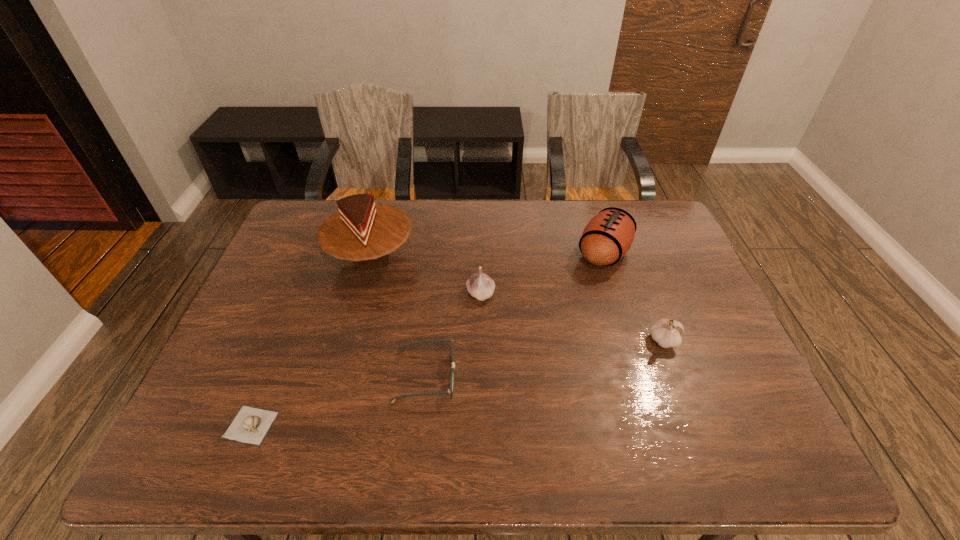
This screenshot has width=960, height=540. Find the location of `the tallest object`. the tallest object is located at coordinates point(362,231).

Locate an element on the screen. This screenshot has height=540, width=960. football (American) is located at coordinates (607, 237).

Where is `the second garlic from left to right`? This screenshot has width=960, height=540. the second garlic from left to right is located at coordinates (480, 286).

In order to click on the fourth object from left to right in this screenshot , I will do `click(480, 286)`.

Identify the location of the second farthest garlic. This screenshot has height=540, width=960. pos(666,332).

Locate an element on the screen. This screenshot has height=540, width=960. spectacles is located at coordinates (450, 391).

What are the coordinates of `the shortest object` in the screenshot? It's located at pyautogui.click(x=250, y=425).

At what (x,y) coordinates should I click in order to perform the action: click on the leftmost garlic. Please return your answer as a coordinate pair (x, y). Looking at the image, I should click on (250, 425).

Image resolution: width=960 pixels, height=540 pixels. In order to click on free region located on the front of the cake in this screenshot , I will do `click(357, 309)`.

Identify the location of free space located 0.250m on the front of the second tallest object. The width and height of the screenshot is (960, 540). (632, 345).